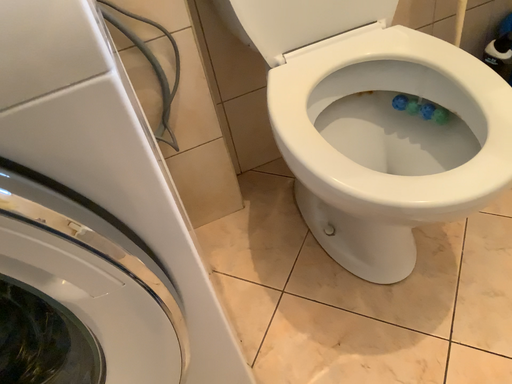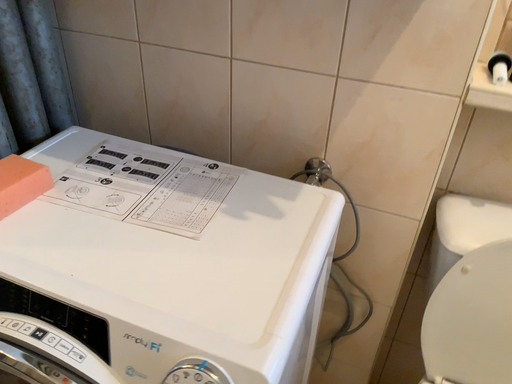
Question: How did the camera likely rotate when shooting the video?

Choices:
 (A) rotated upward
 (B) rotated downward

Answer: (A)